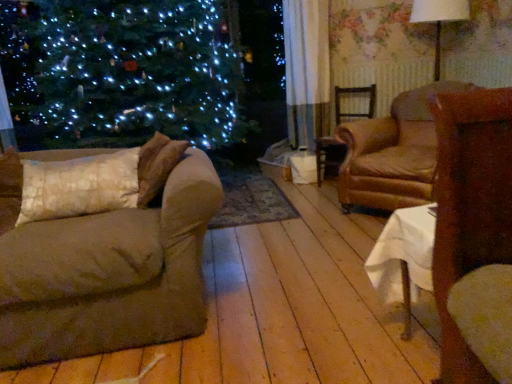
Question: Considering the relative positions of brown fabric couch at left and brown wooden chair at center, the first chair in the back-to-front sequence, in the image provided, is brown fabric couch at left in front of brown wooden chair at center, the first chair in the back-to-front sequence,?

Choices:
 (A) no
 (B) yes

Answer: (B)

Question: From the image's perspective, does brown fabric couch at left appear lower than brown wooden chair at center, the first chair in the back-to-front sequence?

Choices:
 (A) yes
 (B) no

Answer: (A)

Question: Can you confirm if brown fabric couch at left is thinner than brown wooden chair at center, positioned as the 2th chair in front-to-back order?

Choices:
 (A) yes
 (B) no

Answer: (B)

Question: From the image's perspective, is brown fabric couch at left located above brown wooden chair at center, positioned as the 2th chair in front-to-back order?

Choices:
 (A) yes
 (B) no

Answer: (B)

Question: Does brown fabric couch at left touch brown wooden chair at center, the first chair in the back-to-front sequence?

Choices:
 (A) yes
 (B) no

Answer: (B)

Question: Is brown fabric couch at left bigger or smaller than white fabric lampshade at upper right?

Choices:
 (A) small
 (B) big

Answer: (B)

Question: From a real-world perspective, is brown fabric couch at left positioned above or below white fabric lampshade at upper right?

Choices:
 (A) above
 (B) below

Answer: (B)

Question: From their relative heights in the image, would you say brown fabric couch at left is taller or shorter than white fabric lampshade at upper right?

Choices:
 (A) tall
 (B) short

Answer: (A)

Question: Visually, is brown fabric couch at left positioned to the left or to the right of white fabric lampshade at upper right?

Choices:
 (A) right
 (B) left

Answer: (B)

Question: Does point (354, 114) appear closer or farther from the camera than point (445, 13)?

Choices:
 (A) farther
 (B) closer

Answer: (A)

Question: In the image, is brown wooden chair at center, the first chair in the back-to-front sequence, on the left side or the right side of white fabric lampshade at upper right?

Choices:
 (A) left
 (B) right

Answer: (A)

Question: Considering their positions, is brown wooden chair at center, positioned as the 2th chair in front-to-back order, located in front of or behind white fabric lampshade at upper right?

Choices:
 (A) front
 (B) behind

Answer: (B)

Question: Looking at the image, does brown wooden chair at center, the first chair in the back-to-front sequence, seem bigger or smaller compared to white fabric lampshade at upper right?

Choices:
 (A) small
 (B) big

Answer: (A)

Question: Considering the relative positions of white fabric lampshade at upper right and brown leather armchair at center-right, which is the 1th chair from front to back, in the image provided, is white fabric lampshade at upper right to the left or to the right of brown leather armchair at center-right, which is the 1th chair from front to back,?

Choices:
 (A) right
 (B) left

Answer: (A)

Question: Does point (428, 13) appear closer or farther from the camera than point (353, 155)?

Choices:
 (A) farther
 (B) closer

Answer: (A)